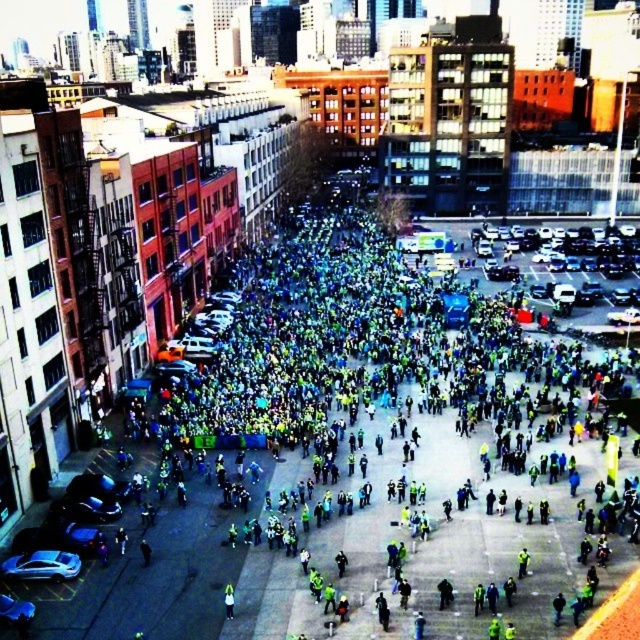
Which is behind, point (401, 412) or point (225, 605)?

Positioned behind is point (401, 412).

Is green reflective jacket at center bigger than green matte jacket at center?

Yes.

This screenshot has height=640, width=640. What are the coordinates of `green reflective jacket at center` in the screenshot? It's located at (342, 460).

Locate an element on the screen. The height and width of the screenshot is (640, 640). green reflective jacket at center is located at coordinates (342, 460).